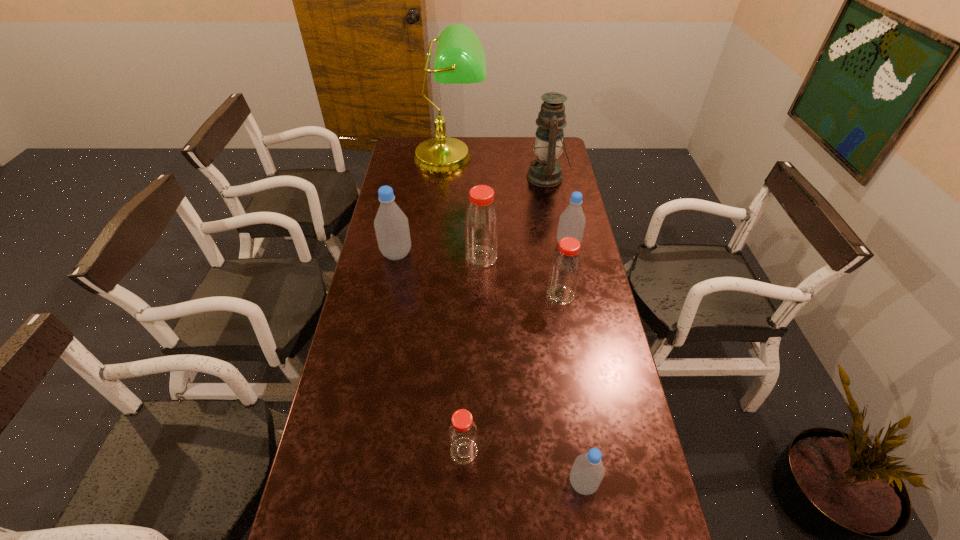
Where is `vacant space situated on the right of the second gray bottle from right to left`? vacant space situated on the right of the second gray bottle from right to left is located at coordinates (637, 483).

Locate an element on the screen. Image resolution: width=960 pixels, height=540 pixels. vacant region located 0.190m on the left of the second nearest bottle is located at coordinates (377, 451).

The width and height of the screenshot is (960, 540). I want to click on lamp present at the far edge, so click(460, 58).

This screenshot has width=960, height=540. What are the coordinates of `oil lamp located in the far edge section of the desktop` in the screenshot? It's located at (545, 171).

Find the location of `lamp at the left edge`. lamp at the left edge is located at coordinates (460, 58).

Identify the location of bottle that is positioned at the left edge. [391, 225].

Locate an element on the screen. The width and height of the screenshot is (960, 540). oil lamp that is at the right edge is located at coordinates click(x=545, y=171).

This screenshot has width=960, height=540. In order to click on object that is at the far left corner in this screenshot , I will do `click(460, 58)`.

The image size is (960, 540). What are the coordinates of `object positioned at the far right corner` in the screenshot? It's located at (545, 171).

This screenshot has height=540, width=960. In the image, there is a desktop. Find the location of `free space at the far edge`. free space at the far edge is located at coordinates (495, 154).